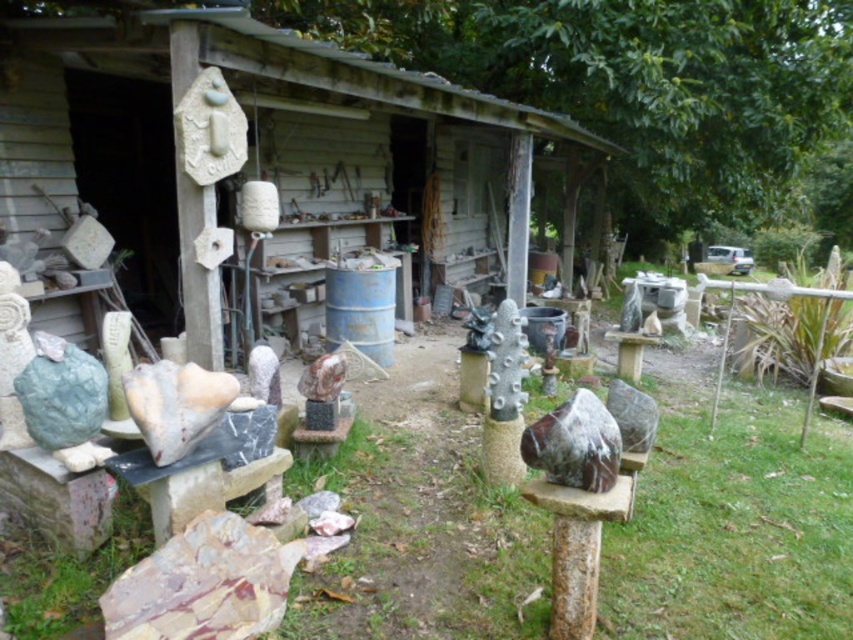
The height and width of the screenshot is (640, 853). Identify the location of rustic wood hut at center. (270, 160).

Which of these two, rustic wood hut at center or marble sculpture at center, stands taller?

Standing taller between the two is marble sculpture at center.

Is point (190, 10) in front of point (129, 552)?

That is False.

Find the location of `rustic wood hut at center`. rustic wood hut at center is located at coordinates click(x=270, y=160).